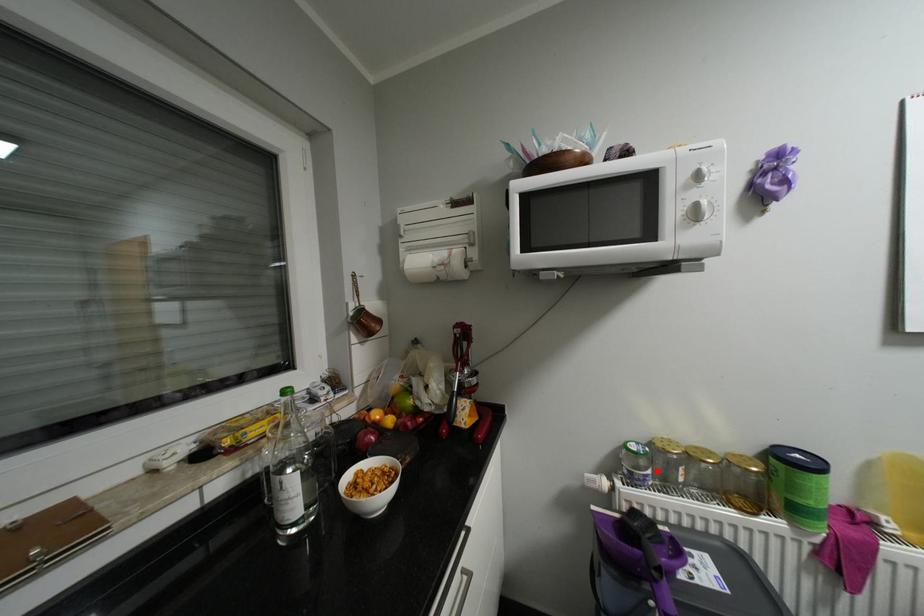
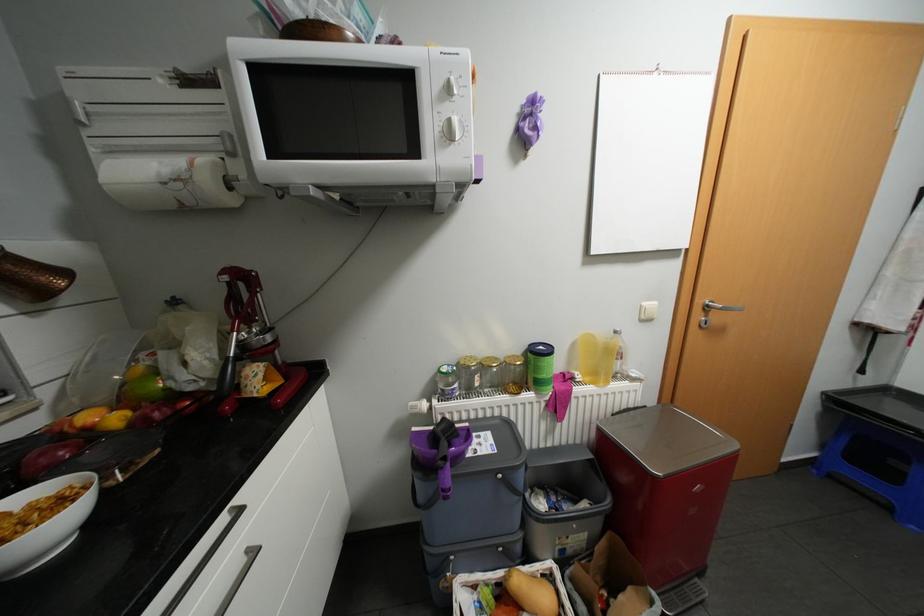
Locate, in the second image, the point that corresponds to the highlighted location in the first image.

(464, 384)